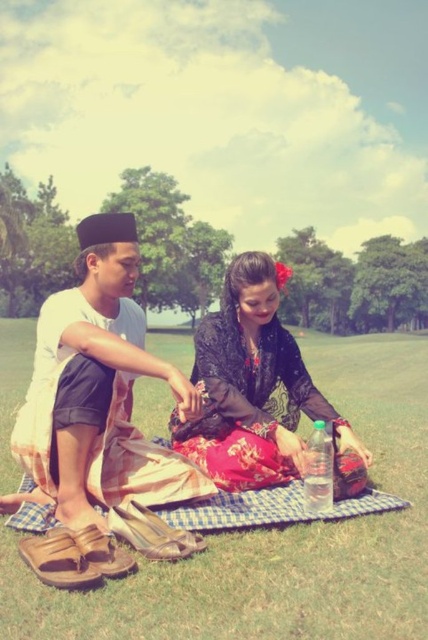
Question: Which object is the farthest from the silky black dress at center?

Choices:
 (A) brown leather sandals at lower left
 (B) green grass at center

Answer: (B)

Question: Which point is farther from the camera taking this photo?

Choices:
 (A) (290, 349)
 (B) (51, 451)

Answer: (A)

Question: Considering the real-world distances, which object is closest to the brown leather sandals at lower left?

Choices:
 (A) green grass at center
 (B) silky black dress at center

Answer: (B)

Question: Can you confirm if green grass at center is positioned to the left of silky black dress at center?

Choices:
 (A) no
 (B) yes

Answer: (A)

Question: In this image, where is green grass at center located relative to silky black dress at center?

Choices:
 (A) right
 (B) left

Answer: (A)

Question: Is brown leather sandals at lower left wider than silky black dress at center?

Choices:
 (A) no
 (B) yes

Answer: (A)